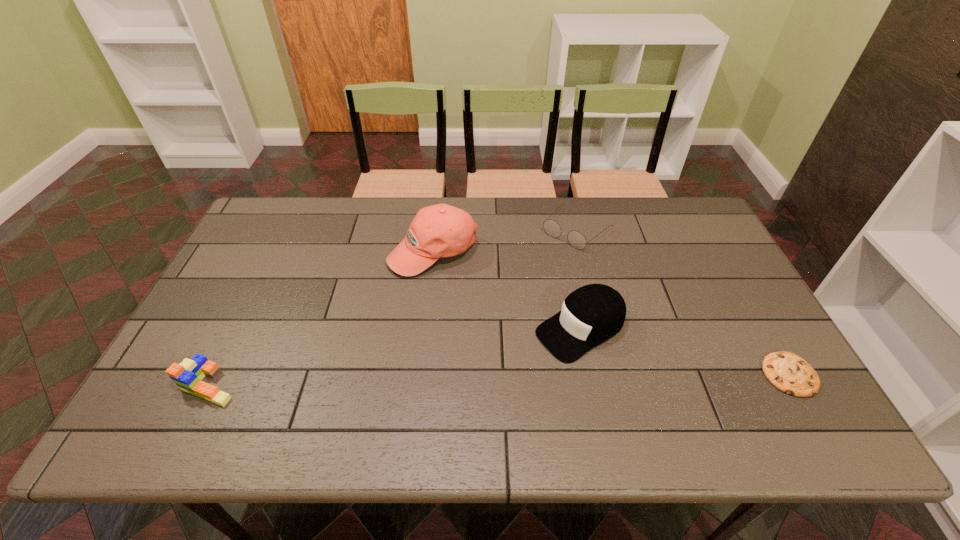
Image resolution: width=960 pixels, height=540 pixels. What are the coordinates of `free spot on the desktop that is between the leftmost object and the rightmost object and is positioned on the temples of the second shortest object` in the screenshot? It's located at (417, 381).

Image resolution: width=960 pixels, height=540 pixels. Identify the location of vacant space on the desktop that is between the leftmost object and the rightmost object and is positioned on the front-facing side of the baseball cap. (426, 381).

The width and height of the screenshot is (960, 540). I want to click on vacant space on the desktop that is between the leftmost object and the rightmost object and is positioned on the front-facing side of the cap, so click(496, 380).